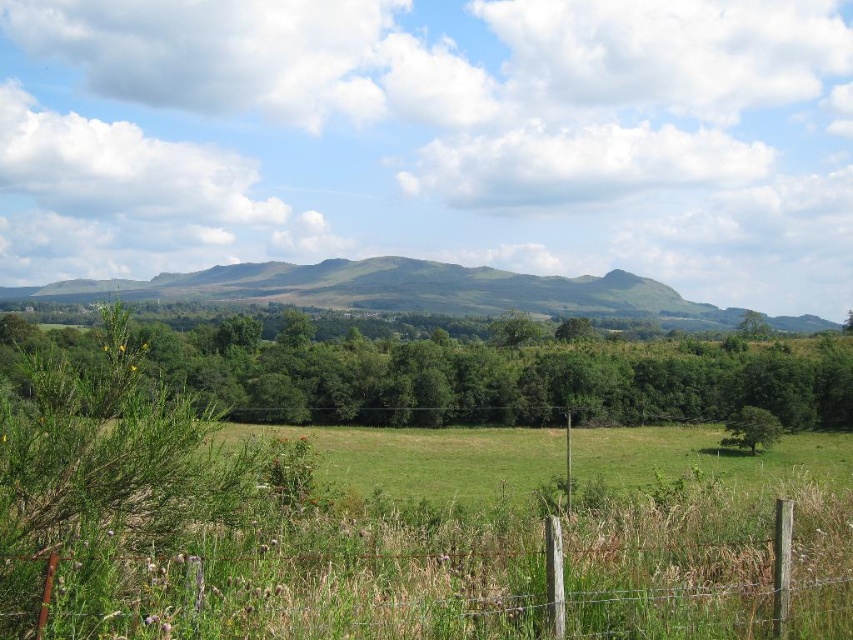
Question: Which of the following is the farthest from the observer?

Choices:
 (A) (831, 396)
 (B) (155, 625)
 (C) (747, 417)

Answer: (A)

Question: Which object appears closest to the camera in this image?

Choices:
 (A) green leafy tree at lower right
 (B) brown wooden fence at lower center
 (C) green grassy hill at center
 (D) green leafy tree at center

Answer: (B)

Question: Where is green leafy tree at center located in relation to green leafy tree at lower right in the image?

Choices:
 (A) above
 (B) below

Answer: (A)

Question: Can you confirm if brown wooden fence at lower center is wider than green grassy hill at center?

Choices:
 (A) yes
 (B) no

Answer: (B)

Question: Can you confirm if green leafy tree at center is positioned to the left of green grassy hill at center?

Choices:
 (A) no
 (B) yes

Answer: (A)

Question: Which object appears closest to the camera in this image?

Choices:
 (A) brown wooden fence at lower center
 (B) green leafy tree at center
 (C) green grassy hill at center

Answer: (A)